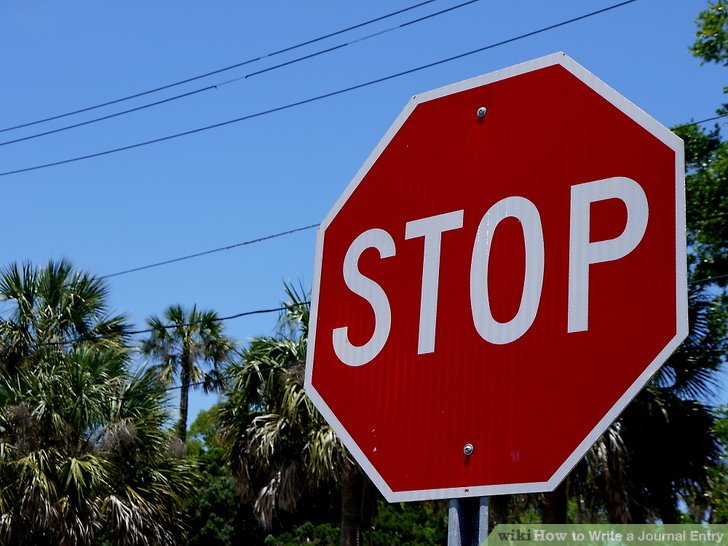
The width and height of the screenshot is (728, 546). I want to click on screws, so click(480, 106), click(464, 448).